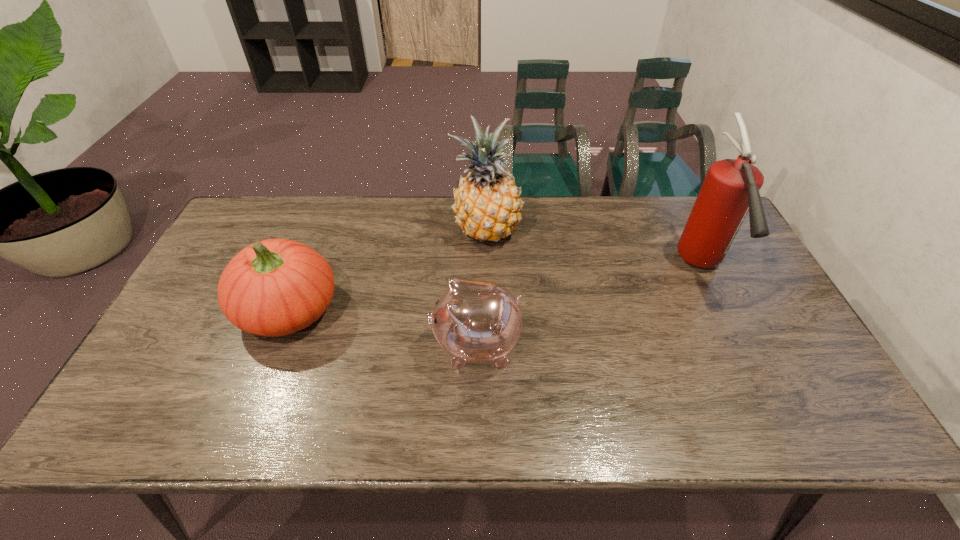
Where is `free location at the far right corner`? free location at the far right corner is located at coordinates (683, 230).

Locate an element on the screen. The image size is (960, 540). free region at the near right corner is located at coordinates (776, 410).

At what (x,y) coordinates should I click in order to perform the action: click on vacant region between the piggy bank and the fire extinguisher. Please return your answer as a coordinate pair (x, y). This screenshot has width=960, height=540. Looking at the image, I should click on (588, 306).

Locate an element on the screen. The image size is (960, 540). free point between the leftmost object and the piggy bank is located at coordinates (382, 327).

Identify the location of unoccupied position between the third shortest object and the pumpkin. (388, 271).

The width and height of the screenshot is (960, 540). Find the location of `vacant area between the second shortest object and the shortest object`. vacant area between the second shortest object and the shortest object is located at coordinates (382, 327).

Image resolution: width=960 pixels, height=540 pixels. What are the coordinates of `free spot between the shortest object and the fire extinguisher` in the screenshot? It's located at (588, 306).

Identify the location of free point between the rightmost object and the third shortest object. This screenshot has height=540, width=960. (593, 249).

The height and width of the screenshot is (540, 960). I want to click on object that can be found as the closest to the shortest object, so click(x=487, y=204).

Locate an element on the screen. object that is the closest to the shortest object is located at coordinates [x=487, y=204].